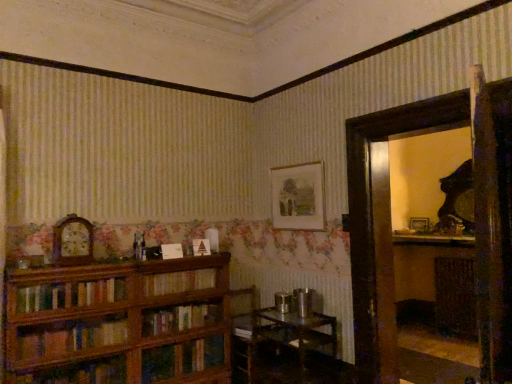
Question: Which direction should I rotate to look at matte paper picture frame at upper center, the first picture frame from the left, — up or down?

Choices:
 (A) up
 (B) down

Answer: (B)

Question: From a real-world perspective, is wooden bookcase at left under matte paper picture frame at upper center, the 2th picture frame positioned from the right?

Choices:
 (A) yes
 (B) no

Answer: (A)

Question: Is wooden bookcase at left thinner than matte paper picture frame at upper center, arranged as the second picture frame when viewed from the back?

Choices:
 (A) yes
 (B) no

Answer: (B)

Question: Is wooden bookcase at left oriented towards matte paper picture frame at upper center, the first picture frame from the left?

Choices:
 (A) no
 (B) yes

Answer: (A)

Question: Does wooden bookcase at left have a greater width compared to matte paper picture frame at upper center, the first picture frame from the left?

Choices:
 (A) no
 (B) yes

Answer: (B)

Question: Is wooden bookcase at left smaller than matte paper picture frame at upper center, which is counted as the first picture frame, starting from the front?

Choices:
 (A) yes
 (B) no

Answer: (B)

Question: Would you say matte paper picture frame at upper center, positioned as the 1th picture frame in top-to-bottom order, is part of wooden bookcase at left's contents?

Choices:
 (A) yes
 (B) no

Answer: (B)

Question: Is wooden bookcase at left taller than metallic silver table at lower center?

Choices:
 (A) yes
 (B) no

Answer: (A)

Question: Is wooden bookcase at left positioned with its back to metallic silver table at lower center?

Choices:
 (A) yes
 (B) no

Answer: (B)

Question: Can you confirm if wooden bookcase at left is smaller than metallic silver table at lower center?

Choices:
 (A) no
 (B) yes

Answer: (A)

Question: Is wooden bookcase at left bigger than metallic silver table at lower center?

Choices:
 (A) no
 (B) yes

Answer: (B)

Question: Considering the relative positions of wooden bookcase at left and metallic silver table at lower center in the image provided, is wooden bookcase at left to the left of metallic silver table at lower center from the viewer's perspective?

Choices:
 (A) yes
 (B) no

Answer: (A)

Question: Is wooden bookcase at left outside of metallic silver table at lower center?

Choices:
 (A) yes
 (B) no

Answer: (A)

Question: Does wooden shelf at right have a greater height compared to wooden picture frame at right, marked as the second picture frame in a top-to-bottom arrangement?

Choices:
 (A) yes
 (B) no

Answer: (A)